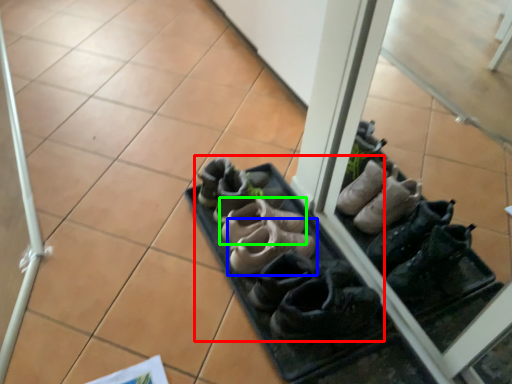
Question: Considering the real-world distances, which object is farthest from footwear (highlighted by a red box)? footwear (highlighted by a blue box) or footwear (highlighted by a green box)?

Choices:
 (A) footwear
 (B) footwear

Answer: (B)